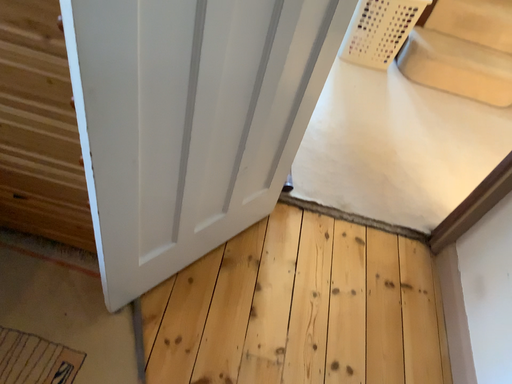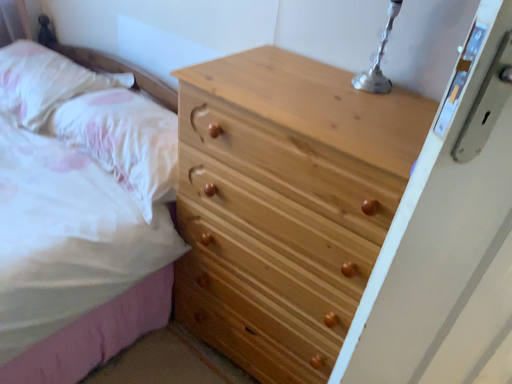
Question: Which way did the camera rotate in the video?

Choices:
 (A) rotated left
 (B) rotated right

Answer: (A)